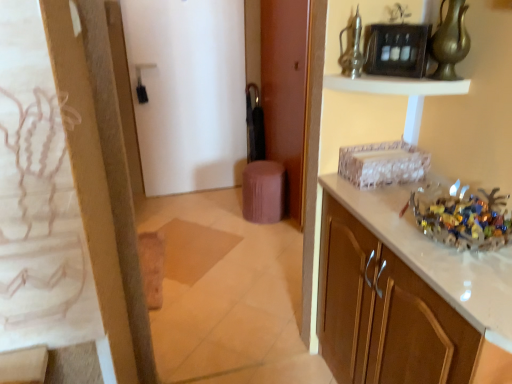
Question: Is purple fabric stool at center far away from white glossy cabinet at right?

Choices:
 (A) yes
 (B) no

Answer: (A)

Question: Can you confirm if purple fabric stool at center is wider than white glossy cabinet at right?

Choices:
 (A) no
 (B) yes

Answer: (A)

Question: Considering the relative sizes of purple fabric stool at center and white glossy cabinet at right in the image provided, is purple fabric stool at center shorter than white glossy cabinet at right?

Choices:
 (A) no
 (B) yes

Answer: (B)

Question: Is purple fabric stool at center positioned in front of white glossy cabinet at right?

Choices:
 (A) no
 (B) yes

Answer: (A)

Question: From a real-world perspective, is purple fabric stool at center physically below white glossy cabinet at right?

Choices:
 (A) yes
 (B) no

Answer: (A)

Question: Is purple fabric stool at center not inside white glossy cabinet at right?

Choices:
 (A) no
 (B) yes

Answer: (B)

Question: Is the depth of brown matte door at center, the second door positioned from the left, less than that of translucent glass bowl at right?

Choices:
 (A) no
 (B) yes

Answer: (A)

Question: Considering the relative sizes of brown matte door at center, acting as the 1th door starting from the right, and translucent glass bowl at right in the image provided, is brown matte door at center, acting as the 1th door starting from the right, wider than translucent glass bowl at right?

Choices:
 (A) no
 (B) yes

Answer: (A)

Question: Is brown matte door at center, the second door positioned from the left, not within translucent glass bowl at right?

Choices:
 (A) yes
 (B) no

Answer: (A)

Question: Is brown matte door at center, acting as the 1th door starting from the right, looking in the opposite direction of translucent glass bowl at right?

Choices:
 (A) no
 (B) yes

Answer: (A)

Question: Considering the relative sizes of brown matte door at center, acting as the 1th door starting from the right, and translucent glass bowl at right in the image provided, is brown matte door at center, acting as the 1th door starting from the right, taller than translucent glass bowl at right?

Choices:
 (A) yes
 (B) no

Answer: (A)

Question: Is brown matte door at center, the second door positioned from the left, oriented towards translucent glass bowl at right?

Choices:
 (A) yes
 (B) no

Answer: (B)

Question: Is metallic glass vase at upper center, which appears as the first glass vase when viewed from the left, at the left side of white glossy shelf at upper center?

Choices:
 (A) yes
 (B) no

Answer: (A)